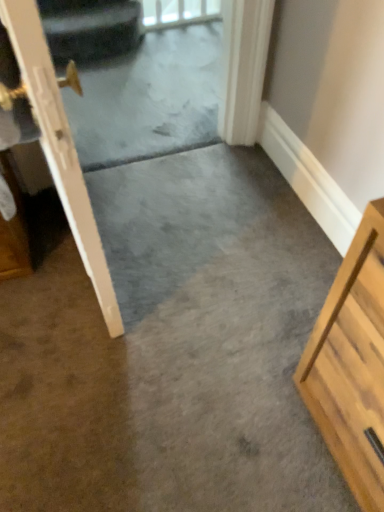
Describe the element at coordinates (90, 28) in the screenshot. I see `metallic gray stairwell at upper left` at that location.

Measure the distance between metallic gray stairwell at upper left and camera.

The depth of metallic gray stairwell at upper left is 2.21 meters.

Identify the location of metallic gray stairwell at upper left. Image resolution: width=384 pixels, height=512 pixels. (90, 28).

Find the location of a particular element. The width and height of the screenshot is (384, 512). metallic gray stairwell at upper left is located at coordinates (90, 28).